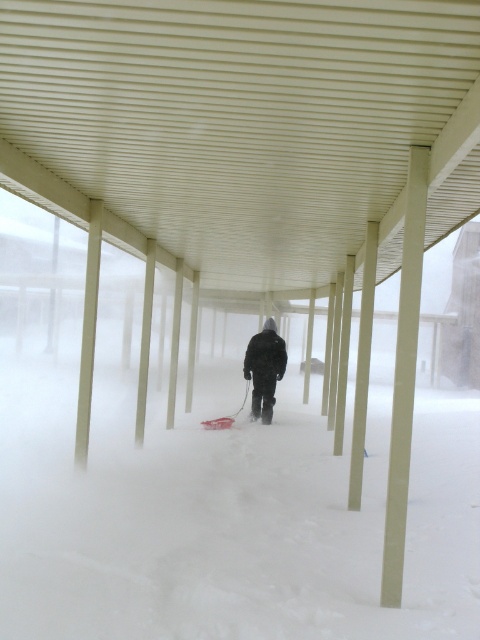
You are standing at the entrance of the parking garage and see the white fluffy snow at center and the dark matte jacket at center. Which object is nearer to you?

The white fluffy snow at center is closer to the viewer than the dark matte jacket at center, so the white fluffy snow at center is nearer to you.

Based on the scene description, which object has a smaller width between the white corrugated metal canopy at center and the white fluffy snow at center?

The white corrugated metal canopy at center has a lesser width compared to the white fluffy snow at center.

You are standing at the entrance of the parking garage and want to take a photo of the dark matte jacket at center. However, the white corrugated metal canopy at center is blocking your view. Can you move to the side to avoid the obstruction?

The white corrugated metal canopy at center is closer to the viewer than the dark matte jacket at center, so moving to the side might allow you to see around the canopy and capture the jacket in your photo.